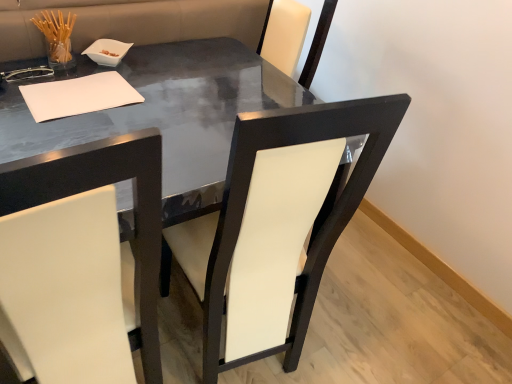
Question: Does glossy black table at center have a greater width compared to white leather chair at left, which is the first chair in left-to-right order?

Choices:
 (A) no
 (B) yes

Answer: (B)

Question: Is white leather chair at left, positioned as the second chair in right-to-left order, at the back of glossy black table at center?

Choices:
 (A) no
 (B) yes

Answer: (A)

Question: Is glossy black table at center taller than white leather chair at left, positioned as the second chair in right-to-left order?

Choices:
 (A) no
 (B) yes

Answer: (A)

Question: From a real-world perspective, is glossy black table at center positioned under white leather chair at left, positioned as the second chair in right-to-left order, based on gravity?

Choices:
 (A) no
 (B) yes

Answer: (B)

Question: Considering the relative sizes of glossy black table at center and white leather chair at left, positioned as the second chair in right-to-left order, in the image provided, is glossy black table at center thinner than white leather chair at left, positioned as the second chair in right-to-left order,?

Choices:
 (A) yes
 (B) no

Answer: (B)

Question: Relative to white leather chair at center, which is counted as the 1th chair, starting from the right, is white paper at upper left in front or behind?

Choices:
 (A) behind
 (B) front

Answer: (A)

Question: Considering the positions of white paper at upper left and white leather chair at center, which is counted as the 1th chair, starting from the right, in the image, is white paper at upper left bigger or smaller than white leather chair at center, which is counted as the 1th chair, starting from the right,?

Choices:
 (A) small
 (B) big

Answer: (A)

Question: Is point (49, 82) closer or farther from the camera than point (396, 102)?

Choices:
 (A) closer
 (B) farther

Answer: (B)

Question: Is white paper at upper left inside the boundaries of white leather chair at center, which is counted as the 1th chair, starting from the right, or outside?

Choices:
 (A) outside
 (B) inside

Answer: (A)

Question: Looking at the image, does glossy black table at center seem bigger or smaller compared to white leather chair at center, arranged as the 2th chair when viewed from the left?

Choices:
 (A) big
 (B) small

Answer: (A)

Question: Visually, is glossy black table at center positioned to the left or to the right of white leather chair at center, which is counted as the 1th chair, starting from the right?

Choices:
 (A) left
 (B) right

Answer: (A)

Question: Considering the positions of glossy black table at center and white leather chair at center, which is counted as the 1th chair, starting from the right, in the image, is glossy black table at center taller or shorter than white leather chair at center, which is counted as the 1th chair, starting from the right,?

Choices:
 (A) short
 (B) tall

Answer: (A)

Question: From the image's perspective, is glossy black table at center located above or below white leather chair at center, arranged as the 2th chair when viewed from the left?

Choices:
 (A) above
 (B) below

Answer: (A)

Question: Would you say white leather chair at left, positioned as the second chair in right-to-left order, is inside or outside white leather chair at center, arranged as the 2th chair when viewed from the left?

Choices:
 (A) inside
 (B) outside

Answer: (B)

Question: In terms of height, does white leather chair at left, positioned as the second chair in right-to-left order, look taller or shorter compared to white leather chair at center, arranged as the 2th chair when viewed from the left?

Choices:
 (A) tall
 (B) short

Answer: (A)